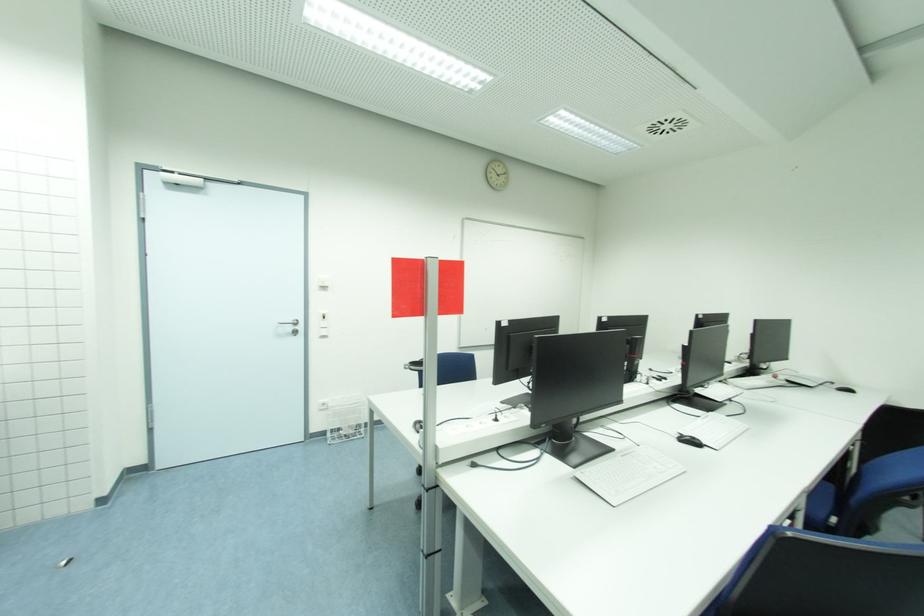
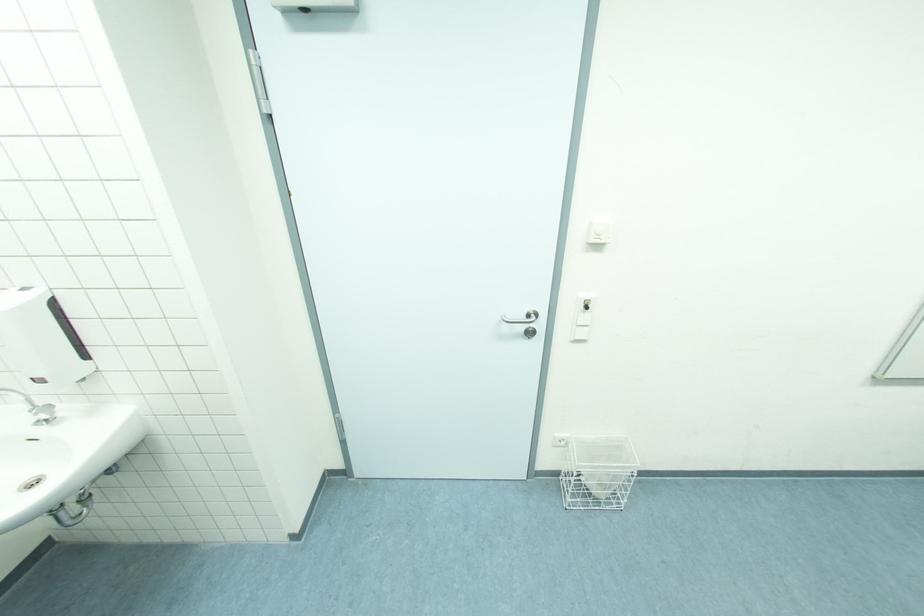
The point at (x=322, y=403) is marked in the first image. Where is the corresponding point in the second image?

(560, 437)